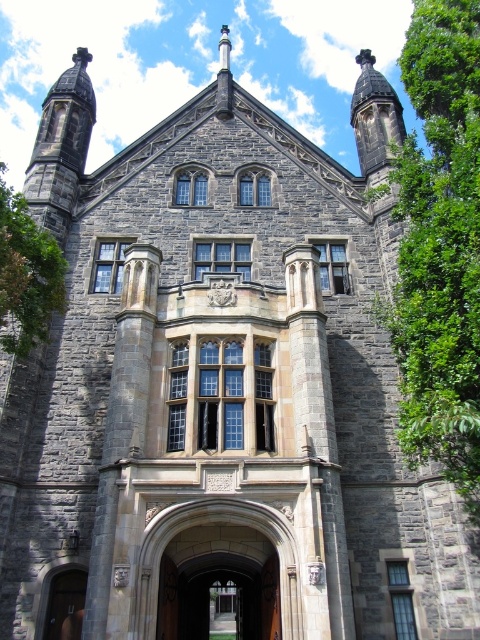
Is point (39, 336) in front of point (51, 611)?

That is False.

The width and height of the screenshot is (480, 640). Describe the element at coordinates (26, 275) in the screenshot. I see `green leafy tree at left` at that location.

Find the location of a particular element. The width and height of the screenshot is (480, 640). green leafy tree at left is located at coordinates (26, 275).

Which is more to the right, green leafy tree at right or green leafy tree at left?

Positioned to the right is green leafy tree at right.

What do you see at coordinates (440, 246) in the screenshot? This screenshot has height=640, width=480. I see `green leafy tree at right` at bounding box center [440, 246].

Image resolution: width=480 pixels, height=640 pixels. What are the coordinates of `green leafy tree at right` in the screenshot? It's located at (440, 246).

Which is more to the left, green leafy tree at right or wooden door at center?

wooden door at center

Does green leafy tree at right come behind wooden door at center?

That is False.

Find the location of a particular element. The height and width of the screenshot is (640, 480). green leafy tree at right is located at coordinates (440, 246).